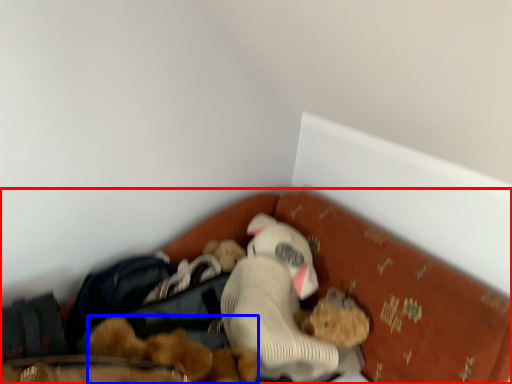
Question: Which point is closer to the camera, bed (highlighted by a red box) or toy (highlighted by a blue box)?

Choices:
 (A) bed
 (B) toy

Answer: (A)